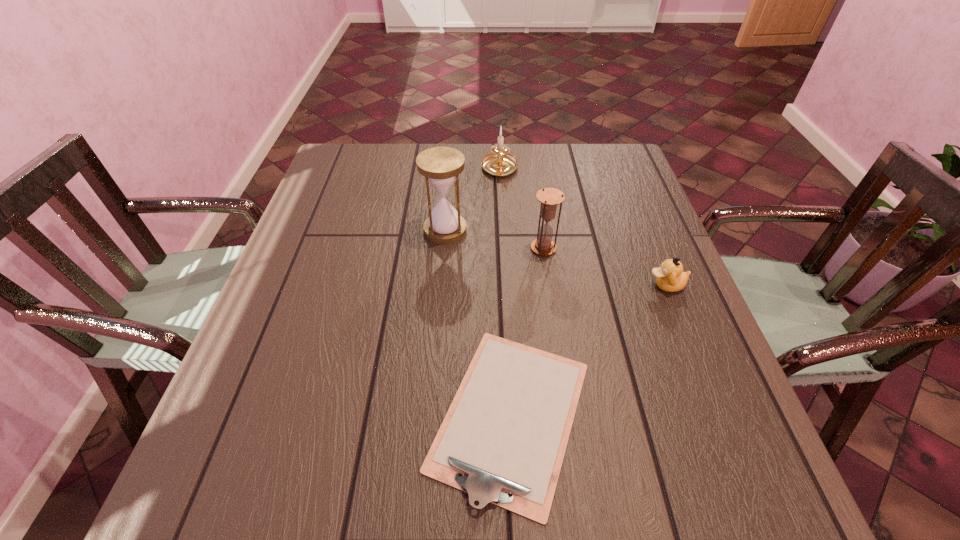
Where is `blank region between the shortest object and the second nearest object`? The height and width of the screenshot is (540, 960). blank region between the shortest object and the second nearest object is located at coordinates (588, 350).

I want to click on free space between the farthest object and the shorter hourglass, so click(x=521, y=208).

Find the location of `vacant point located between the fourth tallest object and the third shortest object`. vacant point located between the fourth tallest object and the third shortest object is located at coordinates (583, 227).

Find the location of a particular element. The width and height of the screenshot is (960, 540). vacant area between the right hourglass and the left hourglass is located at coordinates (x=494, y=239).

This screenshot has height=540, width=960. Find the location of `unoccupied position between the left hourglass and the farthest object`. unoccupied position between the left hourglass and the farthest object is located at coordinates pos(472,200).

Locate which object is the closest to the nearest object. Please provide its 2D coordinates. Your answer should be formatted as a tuple, i.e. [(x, y)], where the tuple contains the x and y coordinates of a point satisfying the conditions above.

[(670, 277)]

Identify the location of object that is the second closest to the tallest object. (499, 163).

You are a GUI agent. You are given a task and a screenshot of the screen. Output one action in this format:
    pyautogui.click(x=<x>, y=<y>)
    Task: Click on the vacant area in the image that satisfies the following two spatial constraints: 1. on the handle side of the shorter hourglass; 2. on the left side of the third shortest object
    The image size is (960, 540).
    Given the screenshot: What is the action you would take?
    pyautogui.click(x=504, y=248)

Image resolution: width=960 pixels, height=540 pixels. Identify the location of free space that satisfies the following two spatial constraints: 1. on the front side of the tallest object; 2. on the left side of the shorter hourglass. (444, 248).

Identify the location of vacant area that satisfies the following two spatial constraints: 1. on the back side of the second tallest object; 2. on the left side of the shortest object. The height and width of the screenshot is (540, 960). (502, 248).